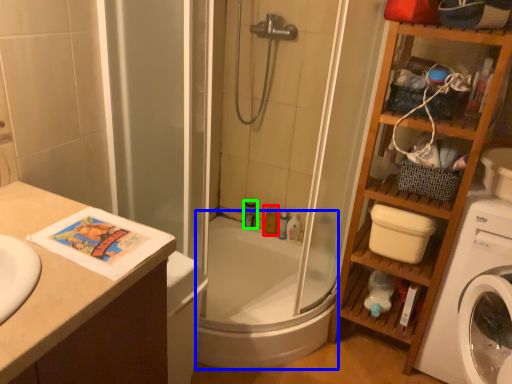
Question: Which object is positioned closest to toiletry (highlighted by a red box)? Select from bath (highlighted by a blue box) and toiletry (highlighted by a green box).

Choices:
 (A) bath
 (B) toiletry

Answer: (B)